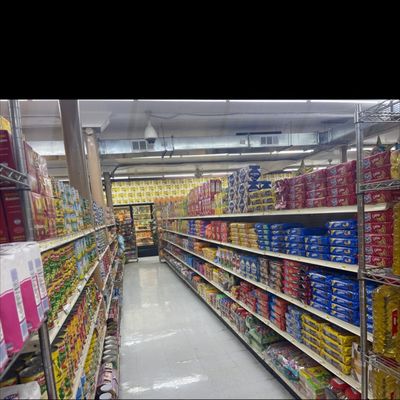
Image resolution: width=400 pixels, height=400 pixels. Identify the location of security camera. (152, 138).